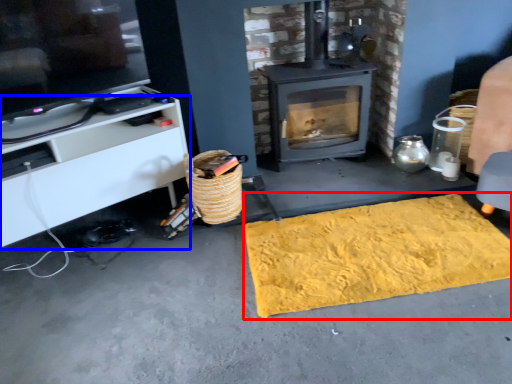
Question: Which object is further to the camera taking this photo, mat (highlighted by a red box) or cabinetry (highlighted by a blue box)?

Choices:
 (A) mat
 (B) cabinetry

Answer: (A)